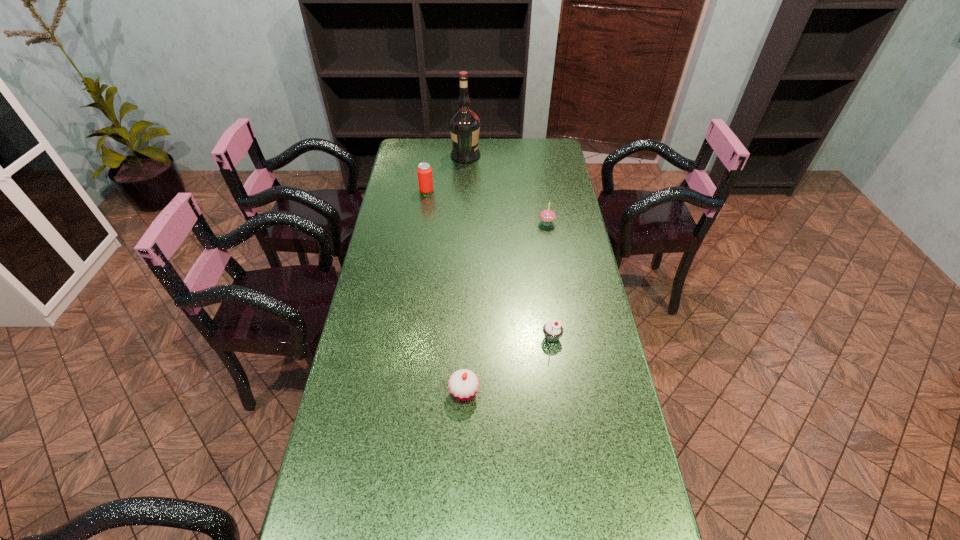
I want to click on the tallest object, so click(x=464, y=124).

Locate an element on the screen. Image resolution: width=960 pixels, height=540 pixels. the farthest object is located at coordinates (464, 124).

You are a GUI agent. You are given a task and a screenshot of the screen. Output one action in this format:
    pyautogui.click(x=<x>, y=<y>)
    Task: Click on the fourth nearest object
    The image size is (960, 540).
    Given the screenshot: What is the action you would take?
    pyautogui.click(x=425, y=179)

Find the location of `the leftmost object`. the leftmost object is located at coordinates (425, 179).

Identify the location of the third nearest object. The width and height of the screenshot is (960, 540). (547, 216).

Locate an element on the screen. Image resolution: width=960 pixels, height=540 pixels. the second nearest object is located at coordinates click(552, 330).

You are a GUI agent. You are given a task and a screenshot of the screen. Output one action in this format:
    pyautogui.click(x=<x>, y=<y>)
    Task: Click on the nearest cupcake
    
    Given the screenshot: What is the action you would take?
    pyautogui.click(x=463, y=384)

I want to click on the nearest object, so click(463, 384).

Image resolution: width=960 pixels, height=540 pixels. I want to click on free spot located 0.290m on the surface of the tallest object, so click(x=544, y=156).

The width and height of the screenshot is (960, 540). What are the coordinates of `free spot located on the back of the beer can` in the screenshot? It's located at (429, 175).